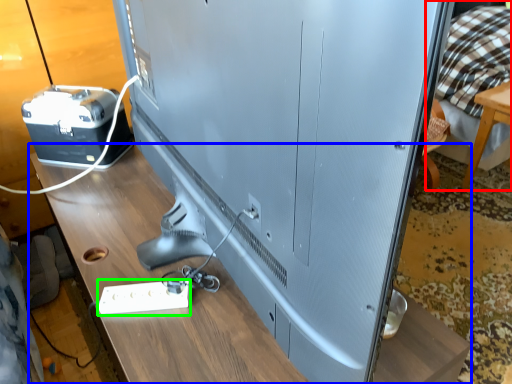
Question: Considering the real-world distances, which object is farthest from bed (highlighted by a red box)? table (highlighted by a blue box) or extension cord (highlighted by a green box)?

Choices:
 (A) table
 (B) extension cord

Answer: (B)